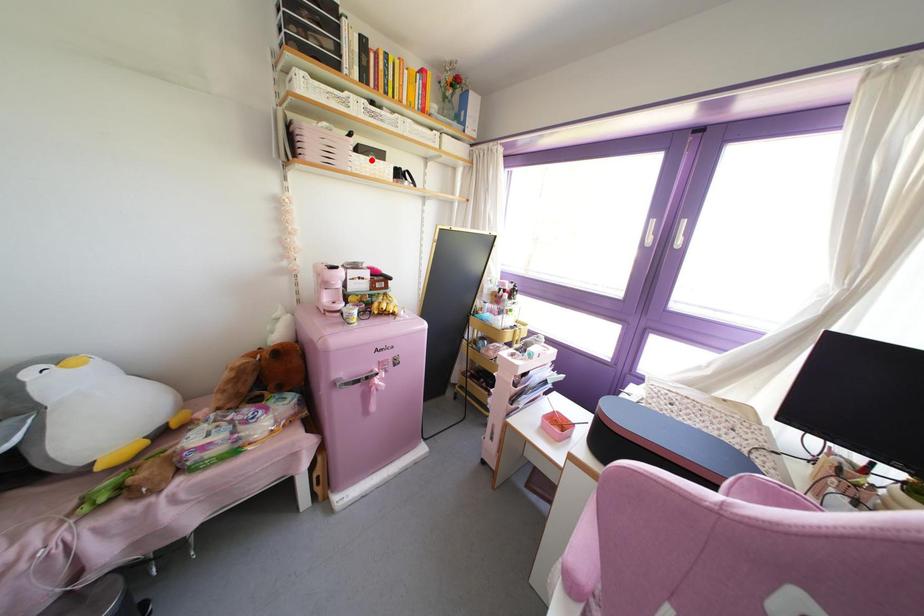
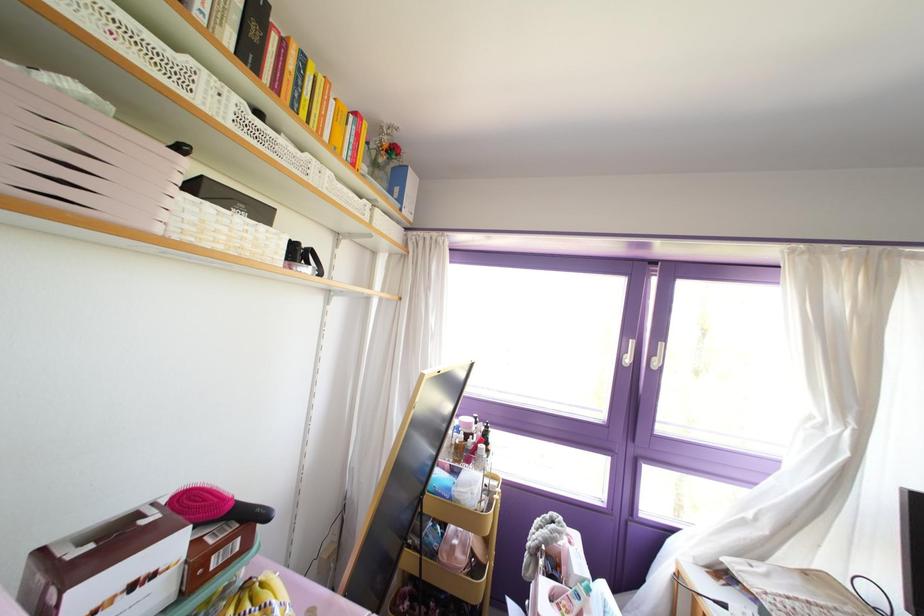
The point at the highlighted location is marked in the first image. Where is the corresponding point in the second image?

(237, 219)